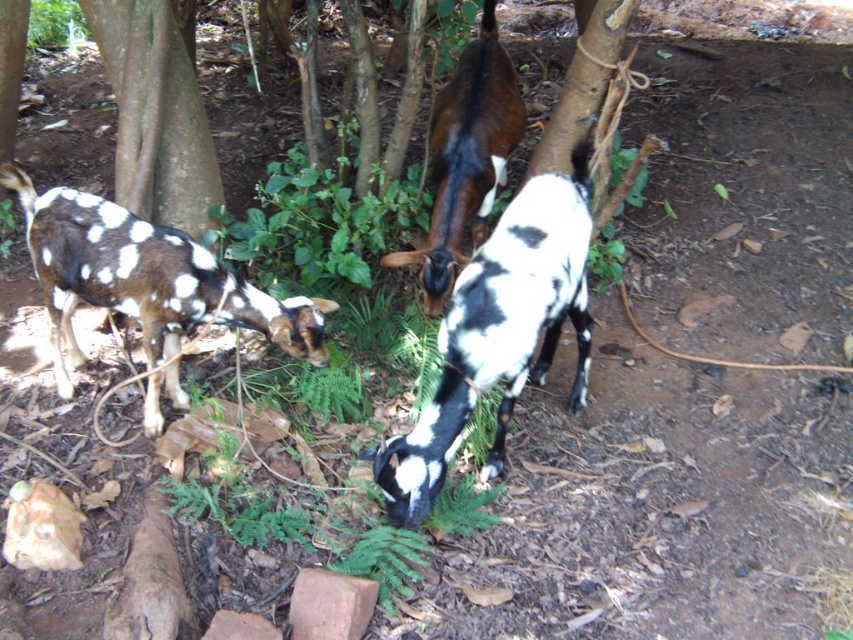
Question: Which object appears closest to the camera in this image?

Choices:
 (A) brown rough tree trunk at upper left
 (B) spotted fur goat at center
 (C) brown glossy goat at center
 (D) spotted fur goat at left

Answer: (B)

Question: Can you confirm if spotted fur goat at center is bigger than red clay brick at lower center?

Choices:
 (A) yes
 (B) no

Answer: (A)

Question: Which of the following is the farthest from the observer?

Choices:
 (A) (84, 284)
 (B) (448, 154)
 (C) (306, 627)

Answer: (B)

Question: Where is spotted fur goat at center located in relation to brown glossy goat at center in the image?

Choices:
 (A) below
 (B) above

Answer: (A)

Question: Does spotted fur goat at left come behind brown rough tree trunk at upper left?

Choices:
 (A) no
 (B) yes

Answer: (A)

Question: Which point is farther to the camera?

Choices:
 (A) (473, 196)
 (B) (579, 336)
 (C) (148, 67)
 (D) (80, 200)

Answer: (A)